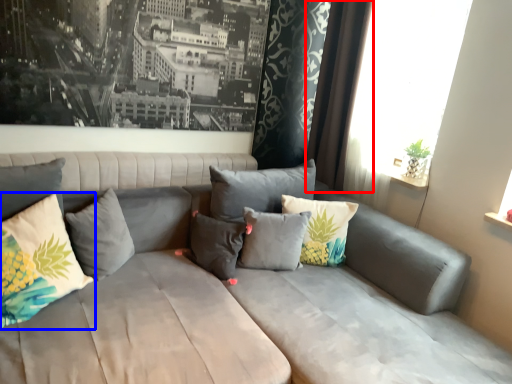
Question: Which of the following is the closest to the observer, curtain (highlighted by a red box) or pillow (highlighted by a blue box)?

Choices:
 (A) curtain
 (B) pillow

Answer: (B)